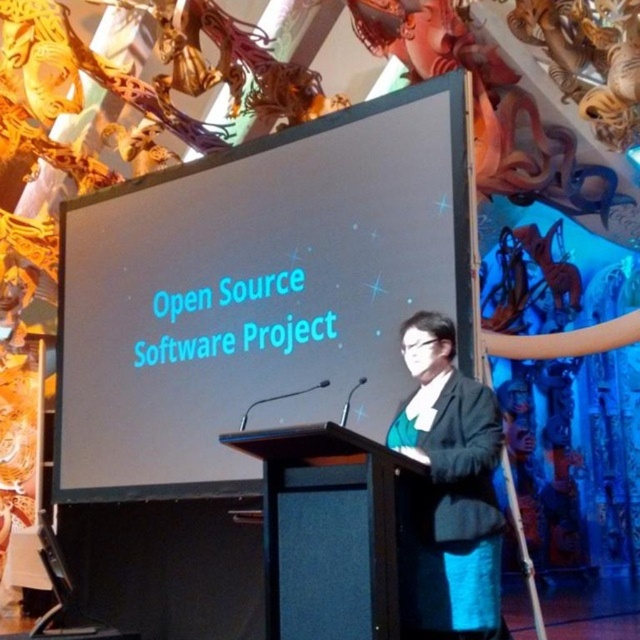
Does point (365, 305) come closer to viewer compared to point (435, 378)?

No, it is not.

Is black glossy projection screen at center to the right of dark gray suit at center from the viewer's perspective?

Incorrect, black glossy projection screen at center is not on the right side of dark gray suit at center.

Locate an element on the screen. Image resolution: width=640 pixels, height=640 pixels. black glossy projection screen at center is located at coordinates (257, 292).

Can you confirm if black glossy projection screen at center is shorter than black matte podium at center?

Yes, black glossy projection screen at center is shorter than black matte podium at center.

What do you see at coordinates (257, 292) in the screenshot? I see `black glossy projection screen at center` at bounding box center [257, 292].

Find the location of a particular element. Image resolution: width=640 pixels, height=640 pixels. black glossy projection screen at center is located at coordinates (257, 292).

Can you confirm if black matte podium at center is positioned below dark gray suit at center?

Correct, black matte podium at center is located below dark gray suit at center.

Which is more to the left, black matte podium at center or dark gray suit at center?

Positioned to the left is black matte podium at center.

Is point (364, 544) more distant than point (464, 566)?

No.

Image resolution: width=640 pixels, height=640 pixels. In order to click on black matte podium at center in this screenshot , I will do `click(328, 531)`.